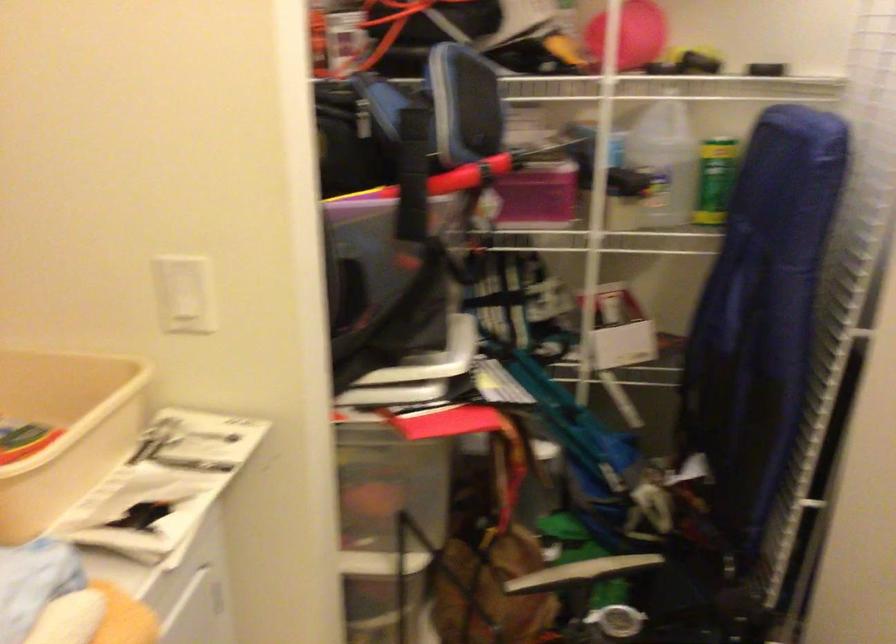
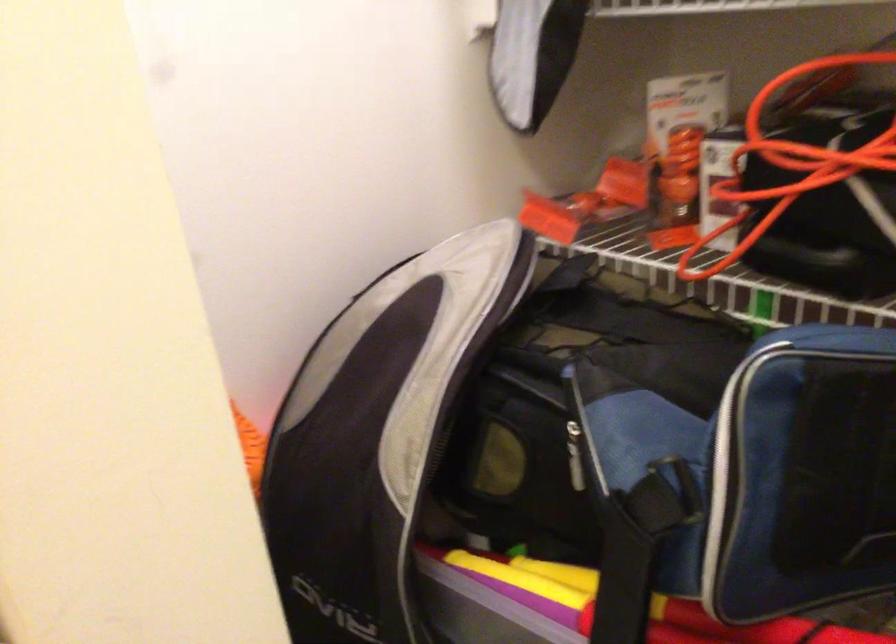
Question: How did the camera likely rotate?

Choices:
 (A) Left
 (B) Right
 (C) Up
 (D) Down

Answer: (A)